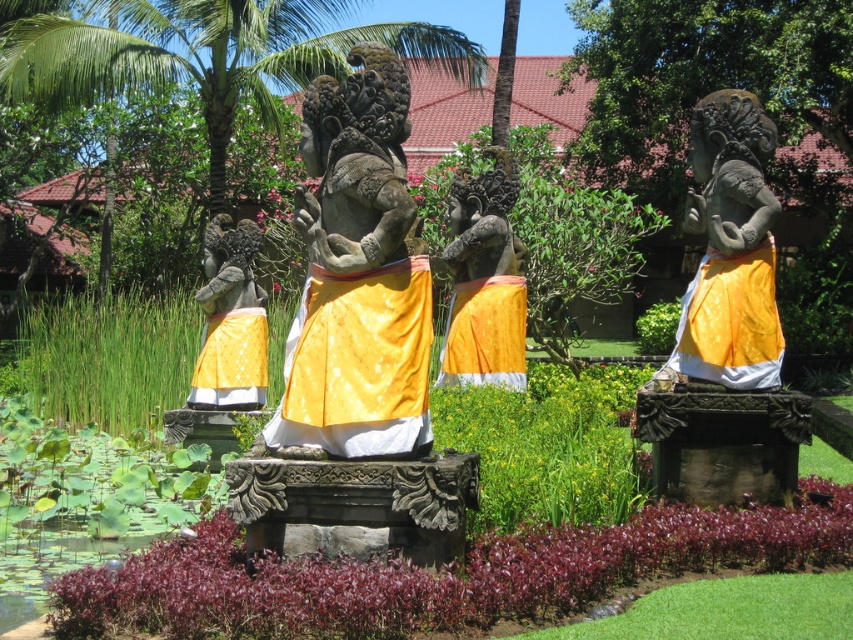
Is point (373, 244) farther from viewer compared to point (190, 20)?

No, it is in front of (190, 20).

Can you confirm if polished stone statue at center is positioned below green leafy palm tree at center?

Yes, polished stone statue at center is below green leafy palm tree at center.

Image resolution: width=853 pixels, height=640 pixels. What do you see at coordinates (357, 275) in the screenshot?
I see `polished stone statue at center` at bounding box center [357, 275].

I want to click on polished stone statue at center, so click(357, 275).

Measure the distance between shiny yellow fabric skirt at center and shiny gold statue at center.

shiny yellow fabric skirt at center and shiny gold statue at center are 6.93 feet apart from each other.

Is shiny yellow fabric skirt at center above shiny gold statue at center?

Indeed, shiny yellow fabric skirt at center is positioned over shiny gold statue at center.

At what (x,y) coordinates should I click in order to perform the action: click on shiny yellow fabric skirt at center. Please return your answer as a coordinate pair (x, y). The width and height of the screenshot is (853, 640). Looking at the image, I should click on (358, 362).

Where is `shiny yellow fabric skirt at center`? This screenshot has width=853, height=640. shiny yellow fabric skirt at center is located at coordinates (358, 362).

Between matte stone statue at center and matte yellow fabric statue at left, which one is positioned lower?

Positioned lower is matte yellow fabric statue at left.

Is matte stone statue at center taller than matte yellow fabric statue at left?

Yes.

The image size is (853, 640). What do you see at coordinates (485, 280) in the screenshot?
I see `matte stone statue at center` at bounding box center [485, 280].

Identify the location of matte stone statue at center. The height and width of the screenshot is (640, 853). (485, 280).